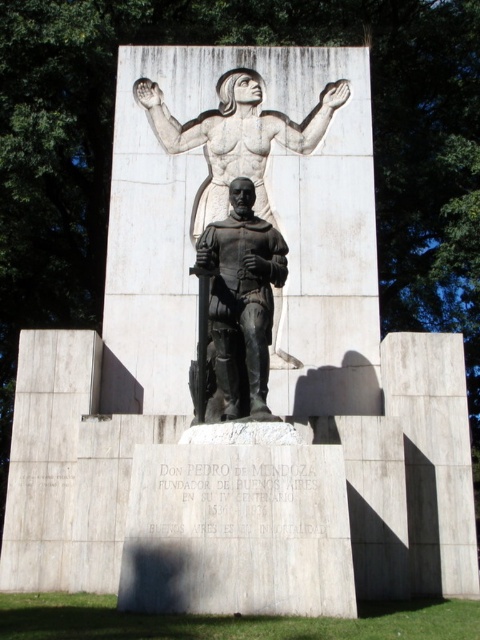
Which is more to the left, bronze statue at center or smooth stone figure at upper center?

smooth stone figure at upper center is more to the left.

Who is more forward, (222,230) or (222,157)?

Positioned in front is point (222,230).

Who is more forward, (222, 372) or (149, 90)?

Positioned in front is point (222, 372).

Identify the location of bronze statue at center. Image resolution: width=480 pixels, height=640 pixels. (241, 300).

Does smooth stone figure at upper center appear over white stone statue at upper center?

Correct, smooth stone figure at upper center is located above white stone statue at upper center.

Does smooth stone figure at upper center have a greater width compared to white stone statue at upper center?

Indeed, smooth stone figure at upper center has a greater width compared to white stone statue at upper center.

Where is `smooth stone figure at upper center`? Image resolution: width=480 pixels, height=640 pixels. smooth stone figure at upper center is located at coordinates (237, 138).

How distant is bronze statue at center from white stone statue at upper center?

They are 8.14 meters apart.

Which is behind, point (218, 244) or point (273, 125)?

Positioned behind is point (273, 125).

Where is `bronze statue at center`? bronze statue at center is located at coordinates (241, 300).